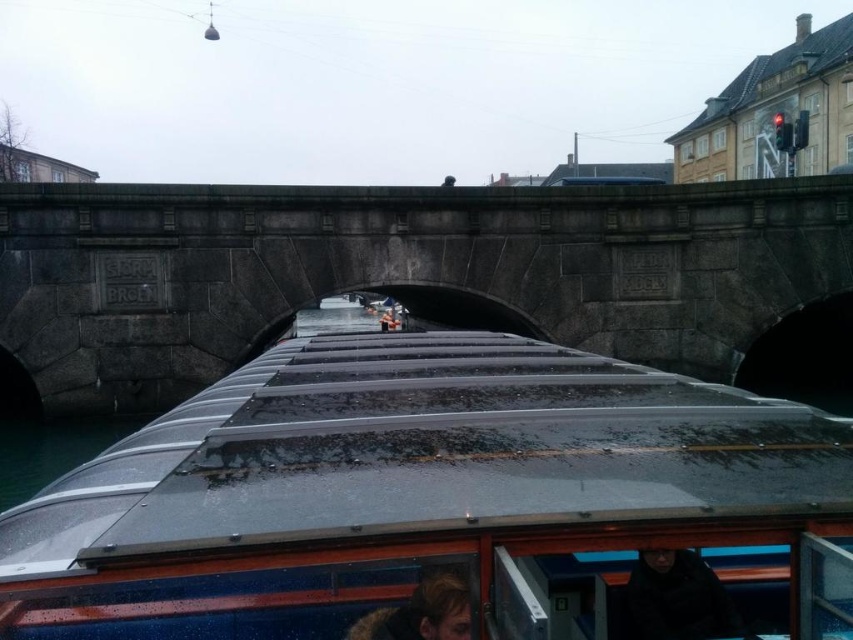
You are a photographer planning to take a photo of the gray stone bridge at center and the clear glass water at lower left. Considering their sizes in the image, which object should you focus on first to ensure it is in sharp focus?

The gray stone bridge at center is bigger than the clear glass water at lower left, so you should focus on the gray stone bridge at center first to ensure it is in sharp focus since larger objects often require more precise focusing to maintain clarity.

You are a photographer standing on the canal boat and want to take a photo of the black matte jacket at lower center and the dark brown hair at lower center. Which object should you focus on first to ensure both are in focus?

The black matte jacket at lower center is positioned under dark brown hair at lower center. Since the jacket is closer to the camera, you should focus on the black matte jacket at lower center first to ensure both are in focus.

You are standing on the canal boat and looking ahead. Where is the gray stone bridge at center located in your field of view?

The gray stone bridge at center is located at the 2D coordinates point (405, 273) in your field of view.